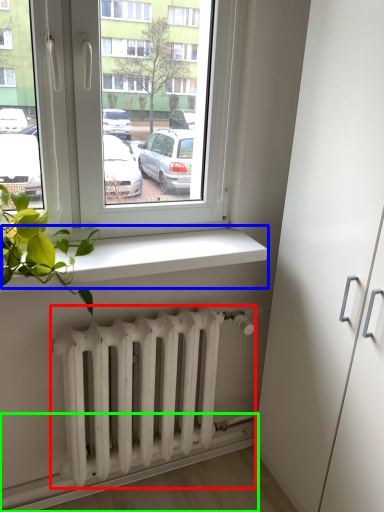
Question: Based on their relative distances, which object is nearer to radiator (highlighted by a red box)? Choose from window sill (highlighted by a blue box) and ledge (highlighted by a green box).

Choices:
 (A) window sill
 (B) ledge

Answer: (B)